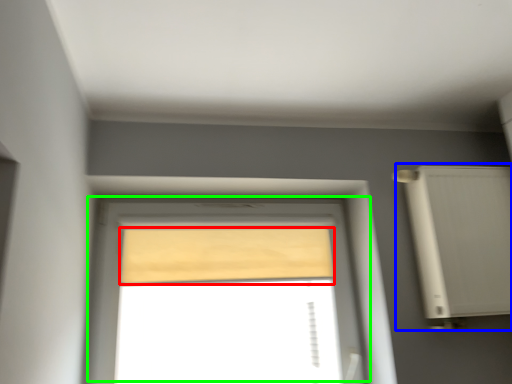
Question: Considering the real-world distances, which object is closest to curtain (highlighted by a red box)? air conditioner (highlighted by a blue box) or window (highlighted by a green box).

Choices:
 (A) air conditioner
 (B) window

Answer: (B)